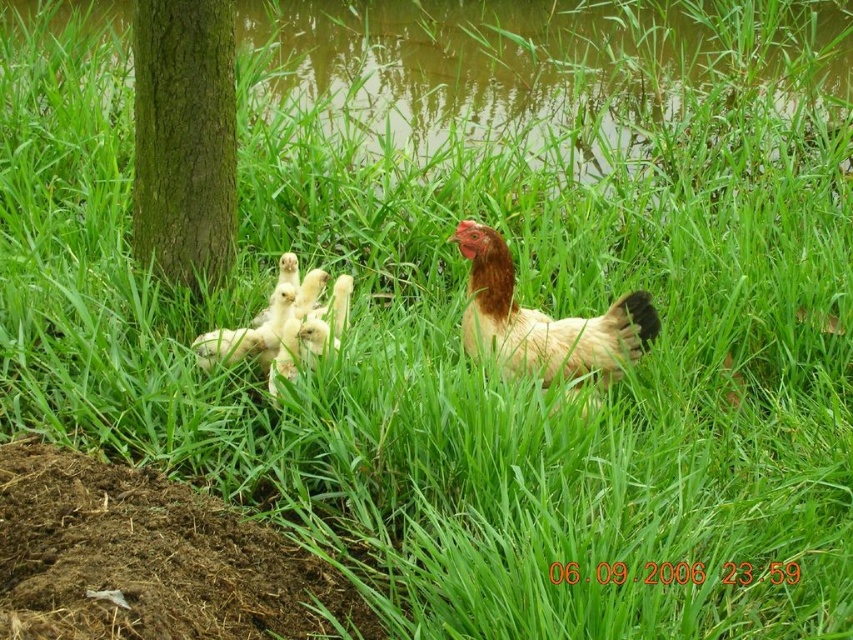
Is brown feathered chicken at center smaller than yellow fluffy chicks at center?

Indeed, brown feathered chicken at center has a smaller size compared to yellow fluffy chicks at center.

From the picture: Between brown feathered chicken at center and yellow fluffy chicks at center, which one has more height?

brown feathered chicken at center

The height and width of the screenshot is (640, 853). Find the location of `brown feathered chicken at center`. brown feathered chicken at center is located at coordinates (544, 321).

Locate an element on the screen. brown feathered chicken at center is located at coordinates (544, 321).

Which is in front, point (231, 58) or point (553, 355)?

Positioned in front is point (553, 355).

Does green rough bark tree at left have a lesser height compared to brown feathered chicken at center?

In fact, green rough bark tree at left may be taller than brown feathered chicken at center.

Which is in front, point (190, 138) or point (610, 378)?

Point (610, 378) is more forward.

Locate an element on the screen. The image size is (853, 640). green rough bark tree at left is located at coordinates point(183,138).

Can you confirm if green rough bark tree at left is shorter than yellow fluffy chicks at center?

Incorrect, green rough bark tree at left's height does not fall short of yellow fluffy chicks at center's.

Does green rough bark tree at left appear on the right side of yellow fluffy chicks at center?

No, green rough bark tree at left is not to the right of yellow fluffy chicks at center.

Which is in front, point (224, 16) or point (288, 332)?

Point (288, 332) is in front.

Image resolution: width=853 pixels, height=640 pixels. Find the location of `green rough bark tree at left`. green rough bark tree at left is located at coordinates (183, 138).